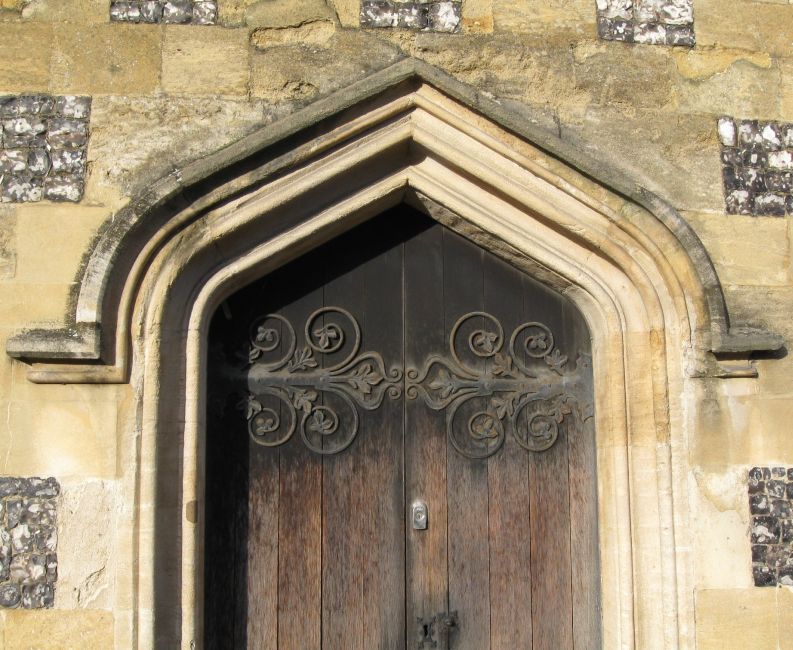
This screenshot has width=793, height=650. Find the location of `door on the left`. door on the left is located at coordinates (303, 552).